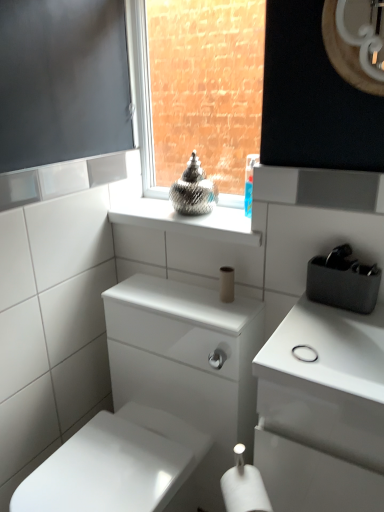
Question: Is white glossy porcelain at center inside or outside of white matte toilet paper at lower center, the second toilet paper in the back-to-front sequence?

Choices:
 (A) outside
 (B) inside

Answer: (A)

Question: From the image's perspective, is white glossy porcelain at center positioned above or below white matte toilet paper at lower center, marked as the second toilet paper in a top-to-bottom arrangement?

Choices:
 (A) above
 (B) below

Answer: (B)

Question: Considering the real-world distances, which object is farthest from the white matte toilet paper at center, the second toilet paper in the front-to-back sequence?

Choices:
 (A) metallic silver vase at upper center
 (B) white glossy porcelain at center
 (C) white matte toilet paper at lower center, marked as the second toilet paper in a top-to-bottom arrangement
 (D) matte glass vase at center
 (E) glossy wood mirror at upper right

Answer: (D)

Question: Which of these objects is positioned farthest from the white matte toilet paper at lower center, marked as the second toilet paper in a top-to-bottom arrangement?

Choices:
 (A) matte glass vase at center
 (B) glossy wood mirror at upper right
 (C) metallic silver vase at upper center
 (D) white matte toilet paper at center, acting as the first toilet paper starting from the top
 (E) white glossy porcelain at center

Answer: (A)